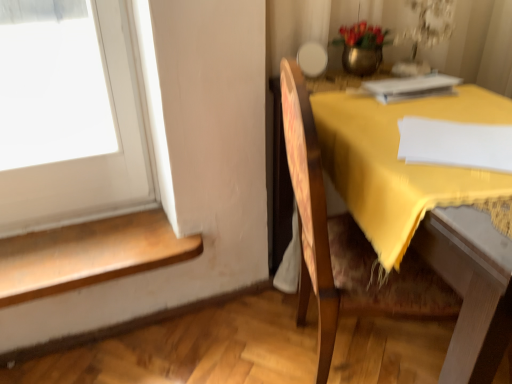
Where is `free space in front of metallic vase at upper center`? Image resolution: width=512 pixels, height=384 pixels. free space in front of metallic vase at upper center is located at coordinates (357, 92).